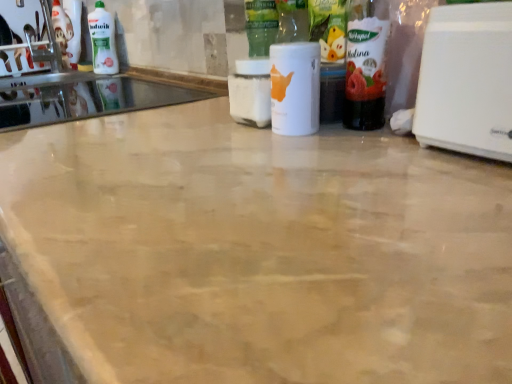
Question: From the image's perspective, does white glossy sink at upper left appear lower than white matte bottle at center, the first bottle viewed from the left?

Choices:
 (A) yes
 (B) no

Answer: (B)

Question: Can you confirm if white glossy sink at upper left is bigger than white matte bottle at center, the 2th bottle when ordered from right to left?

Choices:
 (A) no
 (B) yes

Answer: (B)

Question: Can you confirm if white glossy sink at upper left is smaller than white matte bottle at center, the 2th bottle when ordered from right to left?

Choices:
 (A) yes
 (B) no

Answer: (B)

Question: From a real-world perspective, is white glossy sink at upper left on white matte bottle at center, the first bottle viewed from the left?

Choices:
 (A) yes
 (B) no

Answer: (B)

Question: Is white glossy sink at upper left placed right next to white matte bottle at center, the 2th bottle when ordered from right to left?

Choices:
 (A) no
 (B) yes

Answer: (A)

Question: From a real-world perspective, relative to white glossy bottle at upper left, is white plastic toaster at right vertically above or below?

Choices:
 (A) above
 (B) below

Answer: (B)

Question: In the image, is white plastic toaster at right positioned in front of or behind white glossy bottle at upper left?

Choices:
 (A) front
 (B) behind

Answer: (A)

Question: From the image's perspective, is white plastic toaster at right located above or below white glossy bottle at upper left?

Choices:
 (A) below
 (B) above

Answer: (A)

Question: Is point (444, 140) positioned closer to the camera than point (102, 11)?

Choices:
 (A) farther
 (B) closer

Answer: (B)

Question: Looking at the image, does white glossy sink at upper left seem bigger or smaller compared to white glossy bottle at upper left?

Choices:
 (A) small
 (B) big

Answer: (B)

Question: Is white glossy sink at upper left situated inside white glossy bottle at upper left or outside?

Choices:
 (A) inside
 (B) outside

Answer: (B)

Question: From the image's perspective, is white glossy sink at upper left above or below white glossy bottle at upper left?

Choices:
 (A) below
 (B) above

Answer: (A)

Question: Would you say white glossy sink at upper left is to the left or to the right of white glossy bottle at upper left in the picture?

Choices:
 (A) right
 (B) left

Answer: (A)

Question: Would you say white plastic toaster at right is inside or outside translucent plastic bottle at right, which is the second bottle from left to right?

Choices:
 (A) inside
 (B) outside

Answer: (B)

Question: Would you say white plastic toaster at right is to the left or to the right of translucent plastic bottle at right, which appears as the 1th bottle when viewed from the right, in the picture?

Choices:
 (A) left
 (B) right

Answer: (B)